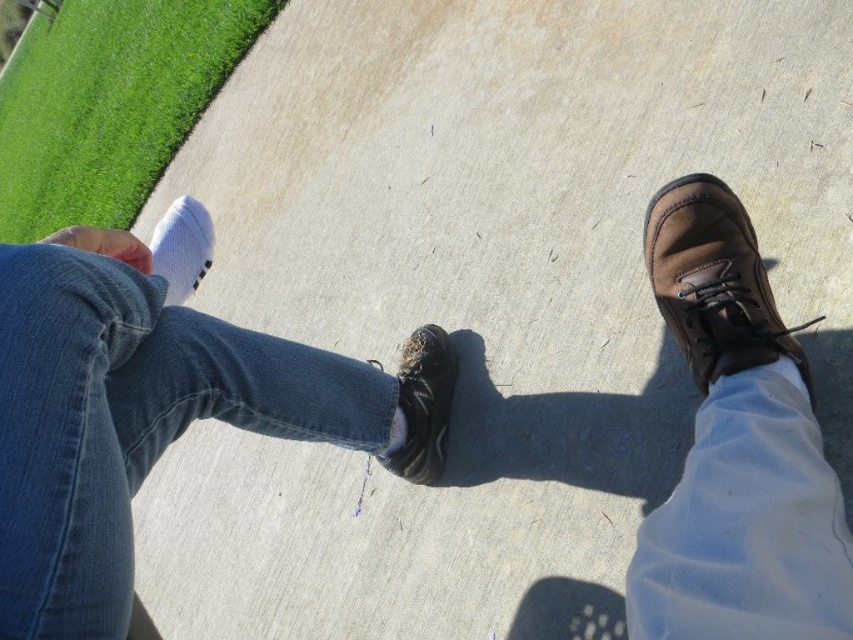
Does point (125, 589) come in front of point (190, 224)?

Yes, it is in front of point (190, 224).

Between denim at left and white soft sock at lower left, which one is positioned lower?

denim at left is below.

The width and height of the screenshot is (853, 640). I want to click on denim at left, so click(128, 420).

Looking at this image, can you confirm if denim at left is thinner than brown suede boot at right?

No, denim at left is not thinner than brown suede boot at right.

Is denim at left smaller than brown suede boot at right?

Actually, denim at left might be larger than brown suede boot at right.

Identify the location of denim at left. (128, 420).

Image resolution: width=853 pixels, height=640 pixels. I want to click on denim at left, so click(x=128, y=420).

From the picture: Is denim at left positioned before brown suede shoe at right?

No, it is behind brown suede shoe at right.

Does denim at left have a lesser width compared to brown suede shoe at right?

Incorrect, denim at left's width is not less than brown suede shoe at right's.

Who is more forward, (82,598) or (770,608)?

Positioned in front is point (770,608).

Where is `denim at left`? The image size is (853, 640). denim at left is located at coordinates (128, 420).